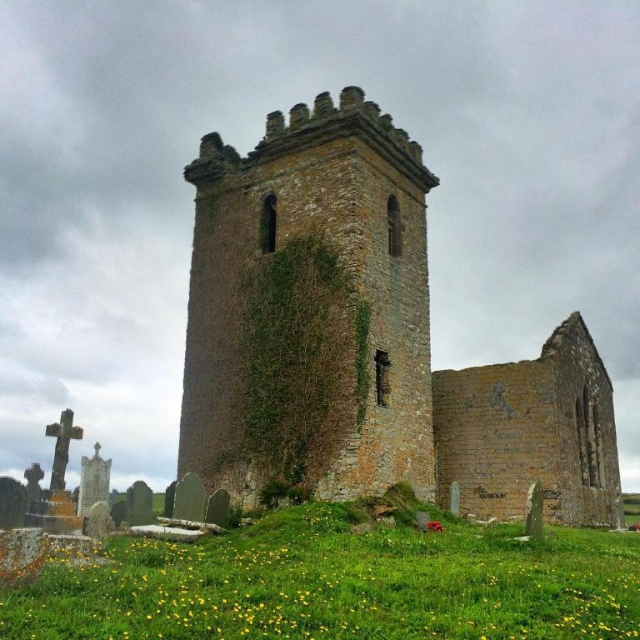
You are standing at the center of the image. Which direction should you look to see the brown stone tower at center?

The brown stone tower at center is located at point coordinates of (364, 339), which is very close to the center of the image. Therefore, you are already facing the brown stone tower at center directly in front of you.

You are standing at the base of the old stone church ruin and looking towards the tall tower. There is a point marked at coordinates (340,586). Based on the scene described, where is this point located in relation to the church ruin?

The point at coordinates (340,586) corresponds to the green grassy field at lower center, which is located in front of the church ruin, near the base where the grassy hill slopes away from the structure.

You are a preservationist assessing the structural integrity of the old stone church ruin. You notice the brown stone tower at center and the green mossy wall at center. Which structure is located higher up in the image?

The brown stone tower at center is positioned under the green mossy wall at center, meaning the green mossy wall at center is higher up in the image.